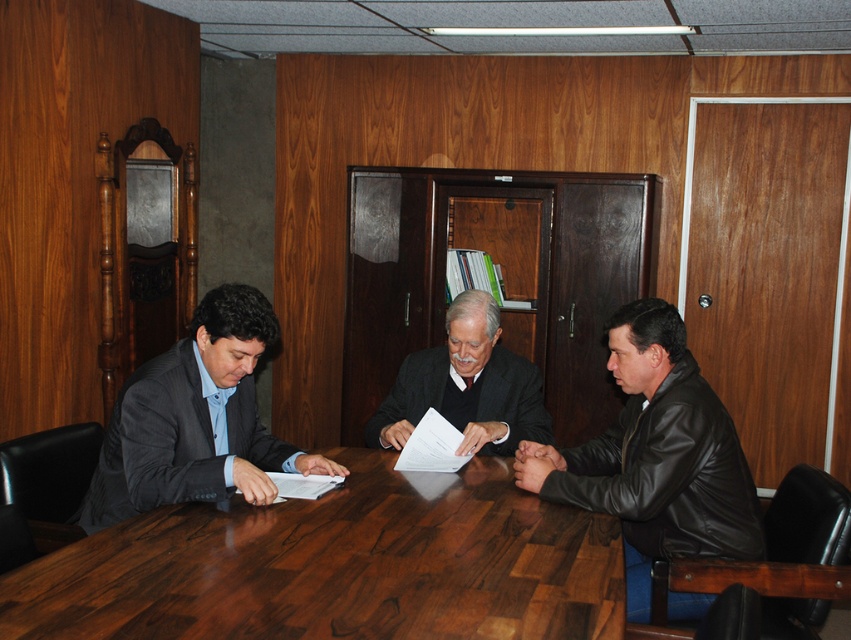
Question: From the image, what is the correct spatial relationship of black leather jacket at lower right in relation to matte gray suit at left?

Choices:
 (A) above
 (B) below

Answer: (B)

Question: Which object appears farthest from the camera in this image?

Choices:
 (A) black leather jacket at lower right
 (B) dark gray suit at center
 (C) wooden at center

Answer: (B)

Question: Is matte gray suit at left wider than white paper at center?

Choices:
 (A) yes
 (B) no

Answer: (A)

Question: Which of the following is the farthest from the observer?

Choices:
 (A) black leather jacket at lower right
 (B) wooden at center
 (C) dark gray suit at center

Answer: (C)

Question: Is matte gray suit at left positioned at the back of white paper at center?

Choices:
 (A) no
 (B) yes

Answer: (A)

Question: Among these objects, which one is nearest to the camera?

Choices:
 (A) wooden at center
 (B) black leather jacket at lower right
 (C) dark gray suit at center

Answer: (A)